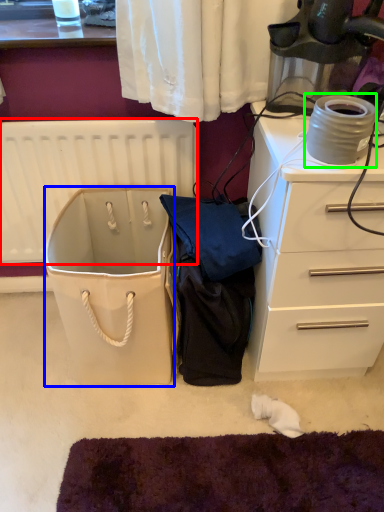
Question: Which object is the closest to the radiator (highlighted by a red box)? Choose among these: wide (highlighted by a blue box) or appliance (highlighted by a green box).

Choices:
 (A) wide
 (B) appliance

Answer: (A)